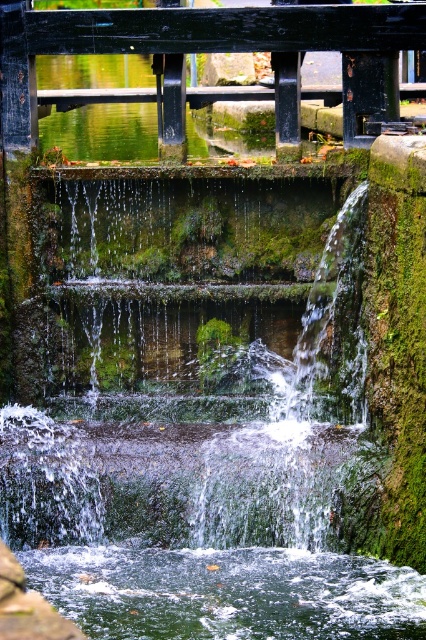
You are standing on the black metal railing above the water feature. You want to observe the green mossy waterfall at center and the green mossy water at lower center. Which one is located above the other?

The green mossy waterfall at center is positioned over the green mossy water at lower center, so the waterfall is above the water.

You are standing at the point marked as point (195, 342) near the water feature. A friend is standing 16.81 meters away from you. Where is your friend located relative to the water feature?

Your friend is 16.81 meters away from point (195, 342), which is your current location near the water feature.

You are standing on the bridge with the black metal railing and want to take a photo of the green mossy waterfall at center and the green mossy water at lower center. Which object should you point your camera towards first if you want to capture both in one shot without moving the camera?

You should point your camera towards the green mossy waterfall at center first because it is to the left of the green mossy water at lower center, so positioning the camera to include both would require framing from the left side where the waterfall is located to the right where the lower water is situated.